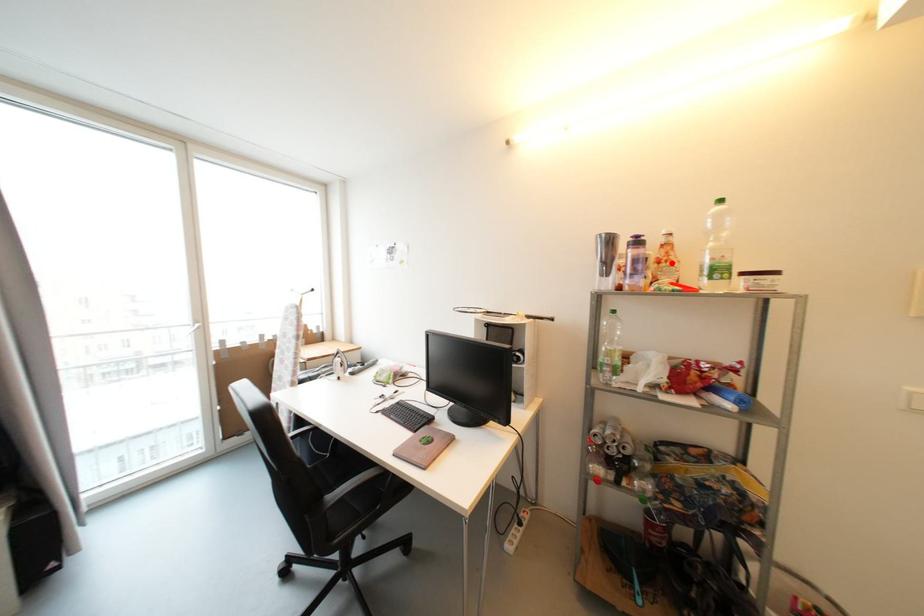
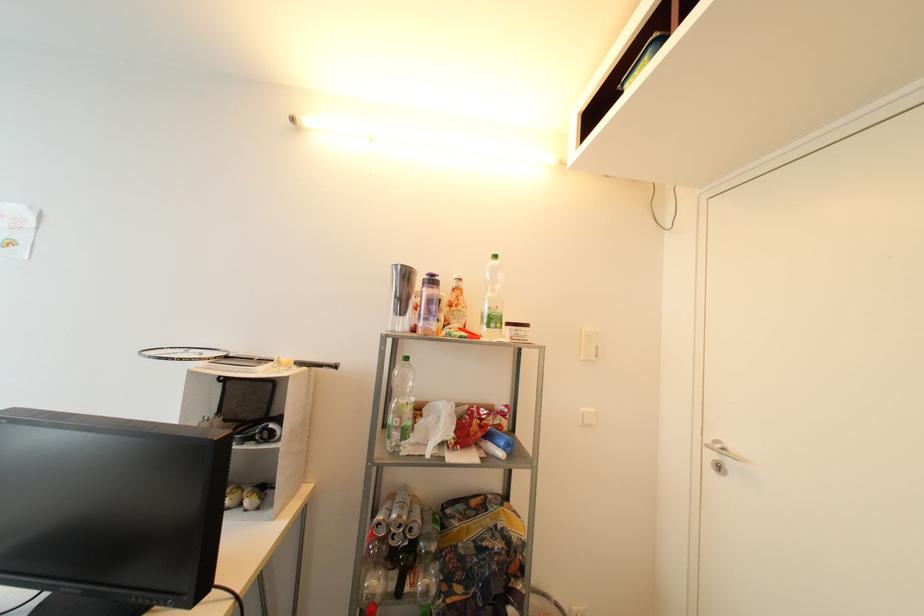
Where in the second image is the point corresponding to the highlighted location from the first image?

(462, 307)